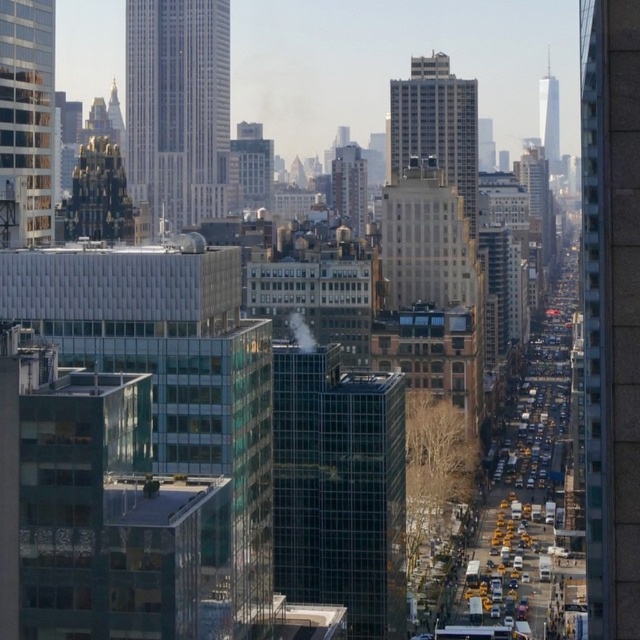
You are a drone operator tasked with flying a drone between the brick textured building at right and the reflective glass skyscraper at left. The drone has a maximum flight distance of 200 meters. Can the drone safely fly between them without exceeding its range?

The brick textured building at right is 231.67 meters from the reflective glass skyscraper at left. Since the drone has a maximum flight distance of 200 meters, it cannot safely fly between them without exceeding its range.

You are a drone operator tasked with flying a drone between the reflective glass skyscraper at left and the white glass tower at upper right. The drone has a maximum flight distance of 200 meters before needing to recharge. Can you safely fly the drone from one to the other without needing to recharge?

The reflective glass skyscraper at left is 210.23 meters away from the white glass tower at upper right. Since the drone can only fly 200 meters before needing to recharge, it cannot safely make the trip without recharging first.

You are standing in the bustling urban landscape and notice a point marked at coordinates (177, 108). Based on the scene description, can you determine which structure this point is located on?

The point at coordinates (177, 108) is located on the white glass skyscraper at upper left.